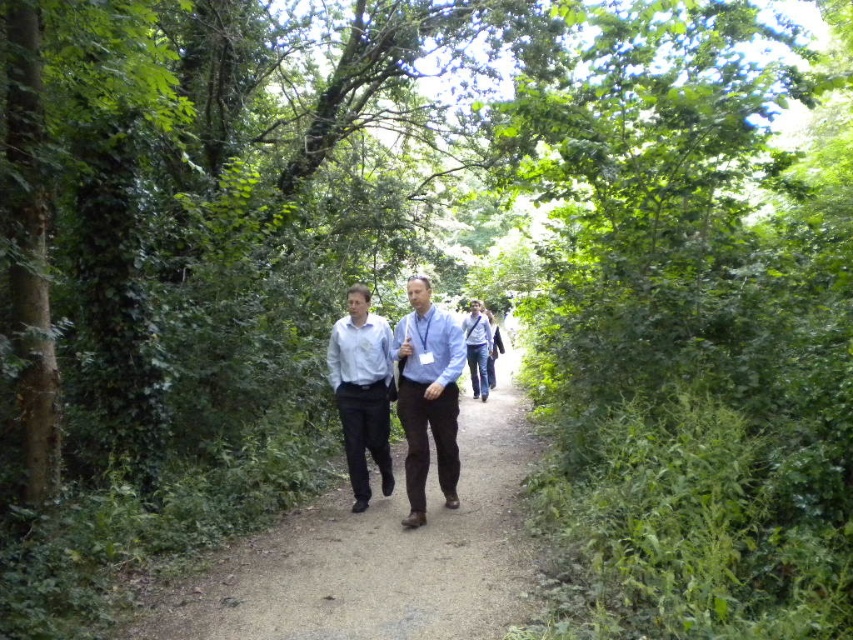
Consider the image. Who is positioned more to the left, blue shirt at center or matte blue shirt at center?

Positioned to the left is matte blue shirt at center.

Is blue shirt at center taller than matte blue shirt at center?

Yes, blue shirt at center is taller than matte blue shirt at center.

Is point (451, 324) farther from viewer compared to point (376, 348)?

That is False.

You are a GUI agent. You are given a task and a screenshot of the screen. Output one action in this format:
    pyautogui.click(x=<x>, y=<y>)
    Task: Click on the blue shirt at center
    The image size is (853, 640).
    Given the screenshot: What is the action you would take?
    pyautogui.click(x=427, y=396)

Can you confirm if smooth dirt path at center is positioned above matte blue shirt at center?

No, smooth dirt path at center is not above matte blue shirt at center.

The height and width of the screenshot is (640, 853). I want to click on smooth dirt path at center, so click(376, 556).

Between smooth dirt path at center and blue shirt at center, which one appears on the left side from the viewer's perspective?

smooth dirt path at center is more to the left.

Which is in front, point (517, 552) or point (415, 282)?

Positioned in front is point (517, 552).

Where is `smooth dirt path at center`? The image size is (853, 640). smooth dirt path at center is located at coordinates (376, 556).

Where is `smooth dirt path at center`? The height and width of the screenshot is (640, 853). smooth dirt path at center is located at coordinates (376, 556).